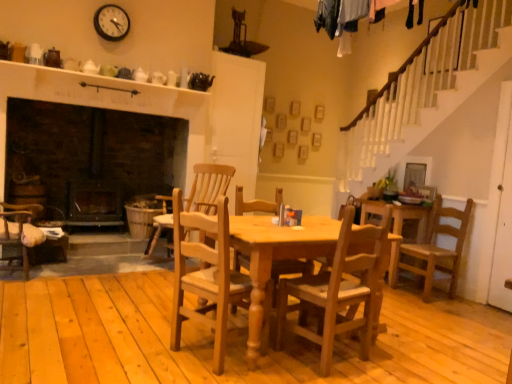
Find the location of a particular element. The image size is (512, 384). vacant region above black plastic clock at upper center (from a real-world perspective) is located at coordinates (111, 4).